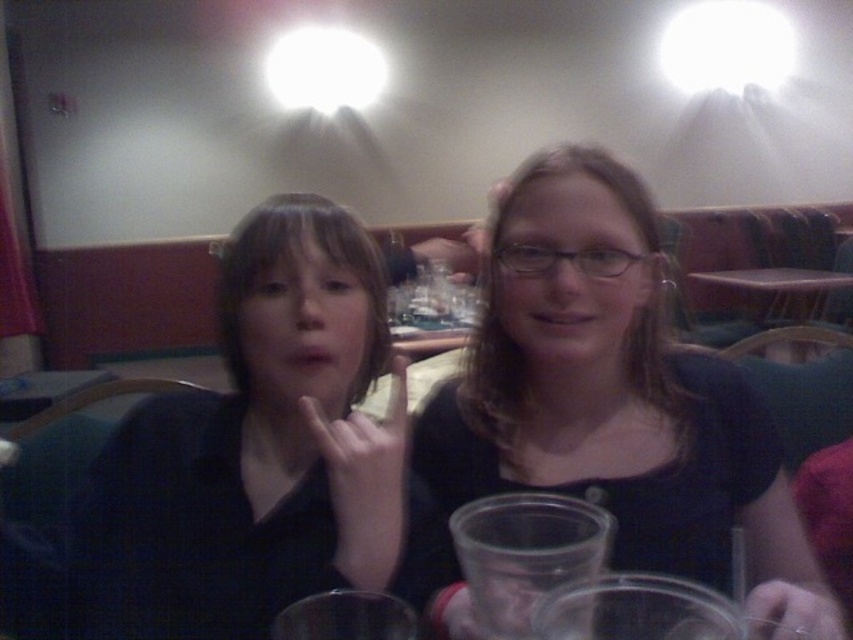
Question: Which object is the closest to the matte black shirt at center?

Choices:
 (A) matte black shirt at left
 (B) purple plastic table at center

Answer: (A)

Question: Does matte black shirt at center have a larger size compared to transparent glass at lower center?

Choices:
 (A) no
 (B) yes

Answer: (B)

Question: Which object is the farthest from the matte black shirt at left?

Choices:
 (A) matte black shirt at center
 (B) purple plastic table at center

Answer: (B)

Question: Is matte black shirt at center positioned before purple plastic table at center?

Choices:
 (A) no
 (B) yes

Answer: (B)

Question: Does matte black shirt at center appear on the left side of purple plastic table at center?

Choices:
 (A) no
 (B) yes

Answer: (B)

Question: Which of these objects is positioned closest to the transparent glass at lower center?

Choices:
 (A) purple plastic table at center
 (B) matte black shirt at center

Answer: (B)